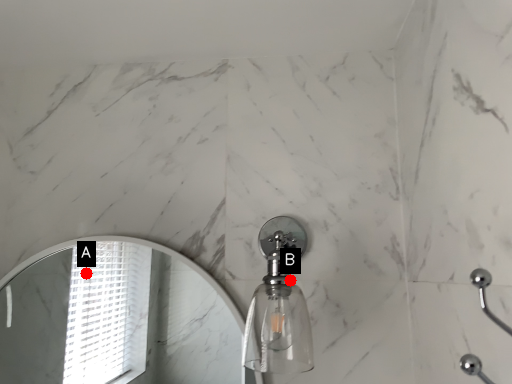
Question: Two points are circled on the image, labeled by A and B beside each circle. Which point is further to the camera?

Choices:
 (A) A is further
 (B) B is further

Answer: (A)